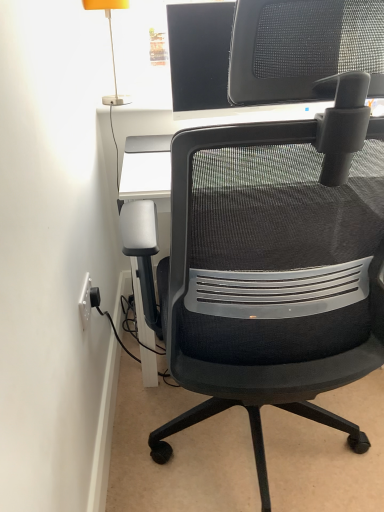
Question: Is orange fabric lampshade at upper left looking in the opposite direction of black mesh office chair at center?

Choices:
 (A) yes
 (B) no

Answer: (B)

Question: Considering the relative sizes of orange fabric lampshade at upper left and black mesh office chair at center in the image provided, is orange fabric lampshade at upper left thinner than black mesh office chair at center?

Choices:
 (A) no
 (B) yes

Answer: (B)

Question: From a real-world perspective, is orange fabric lampshade at upper left physically above black mesh office chair at center?

Choices:
 (A) yes
 (B) no

Answer: (A)

Question: Is orange fabric lampshade at upper left at the right side of black mesh office chair at center?

Choices:
 (A) no
 (B) yes

Answer: (A)

Question: Can you confirm if orange fabric lampshade at upper left is wider than black mesh office chair at center?

Choices:
 (A) yes
 (B) no

Answer: (B)

Question: Are orange fabric lampshade at upper left and black mesh office chair at center beside each other?

Choices:
 (A) no
 (B) yes

Answer: (A)

Question: Is black mesh office chair at center wider than orange fabric lampshade at upper left?

Choices:
 (A) yes
 (B) no

Answer: (A)

Question: Considering the relative positions of black mesh office chair at center and orange fabric lampshade at upper left in the image provided, is black mesh office chair at center to the left of orange fabric lampshade at upper left from the viewer's perspective?

Choices:
 (A) yes
 (B) no

Answer: (B)

Question: Is black mesh office chair at center shorter than orange fabric lampshade at upper left?

Choices:
 (A) no
 (B) yes

Answer: (A)

Question: Is black mesh office chair at center outside of orange fabric lampshade at upper left?

Choices:
 (A) no
 (B) yes

Answer: (B)

Question: Is black mesh office chair at center oriented away from orange fabric lampshade at upper left?

Choices:
 (A) no
 (B) yes

Answer: (A)

Question: Is orange fabric lampshade at upper left located within black mesh office chair at center?

Choices:
 (A) yes
 (B) no

Answer: (B)

Question: Visually, is orange fabric lampshade at upper left positioned to the left or to the right of black mesh office chair at center?

Choices:
 (A) right
 (B) left

Answer: (B)